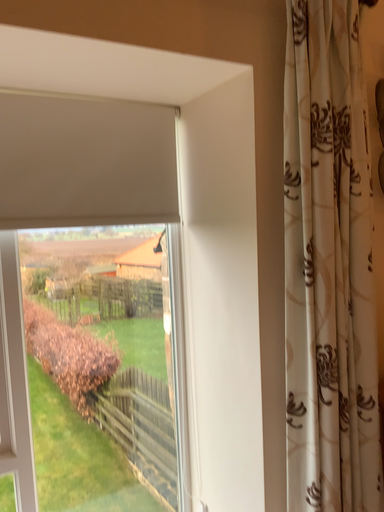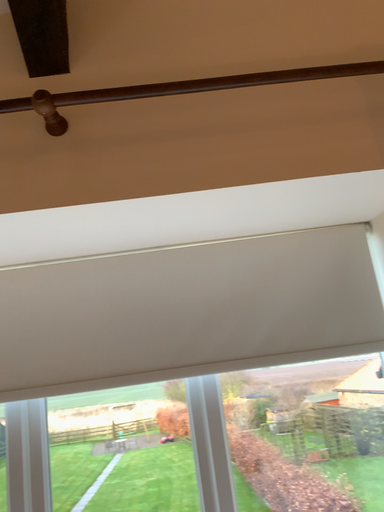
Question: How did the camera likely rotate when shooting the video?

Choices:
 (A) rotated left
 (B) rotated right

Answer: (A)